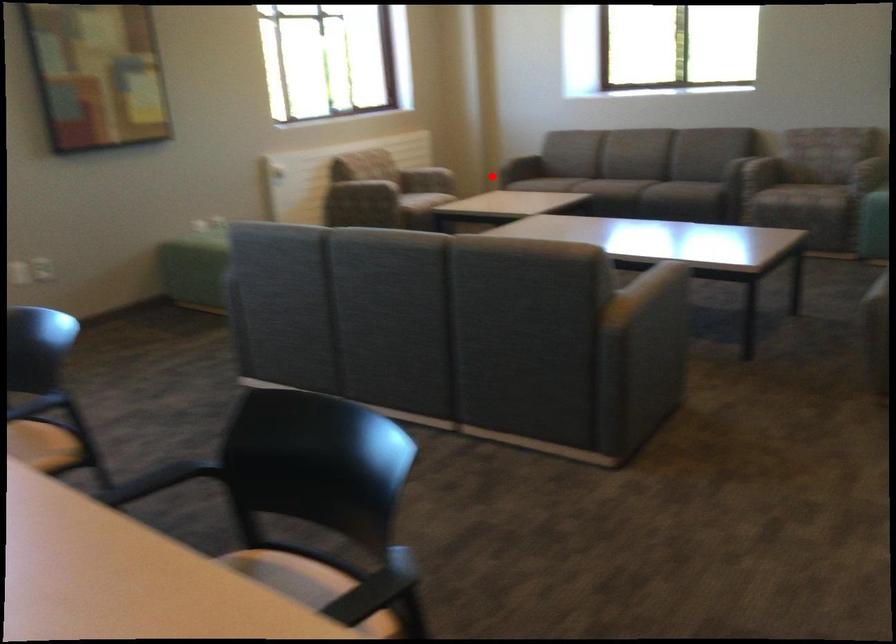
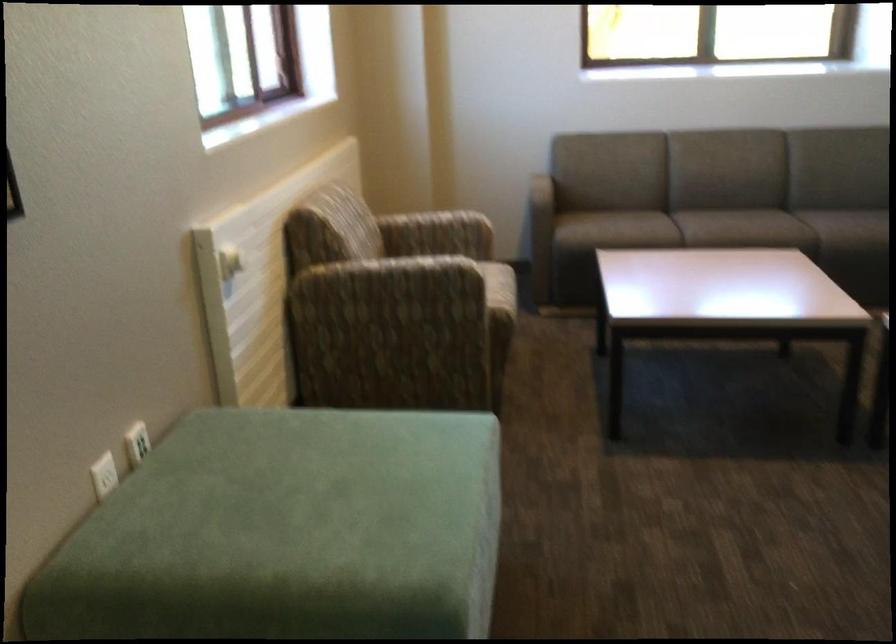
Question: I am providing you with two images of the same scene from different viewpoints. A red point is shown in image1. For the corresponding object point in image2, is it positioned nearer or farther from the camera?

Choices:
 (A) Nearer
 (B) Farther

Answer: (A)